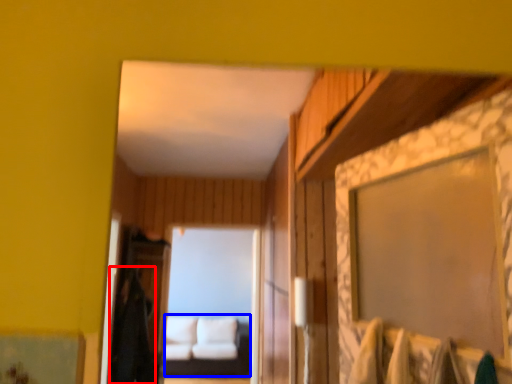
Question: Among these objects, which one is farthest to the camera, robe (highlighted by a red box) or couch (highlighted by a blue box)?

Choices:
 (A) robe
 (B) couch

Answer: (B)